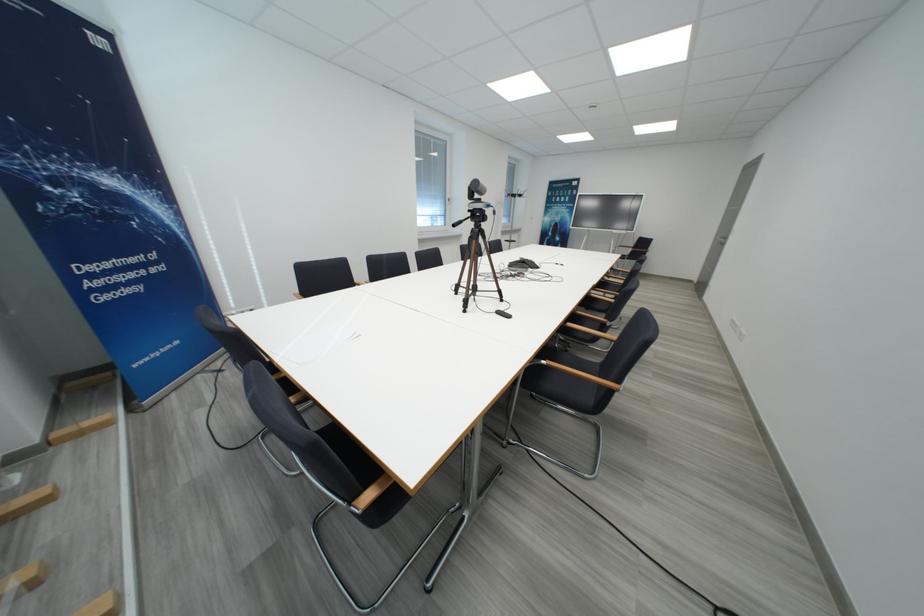
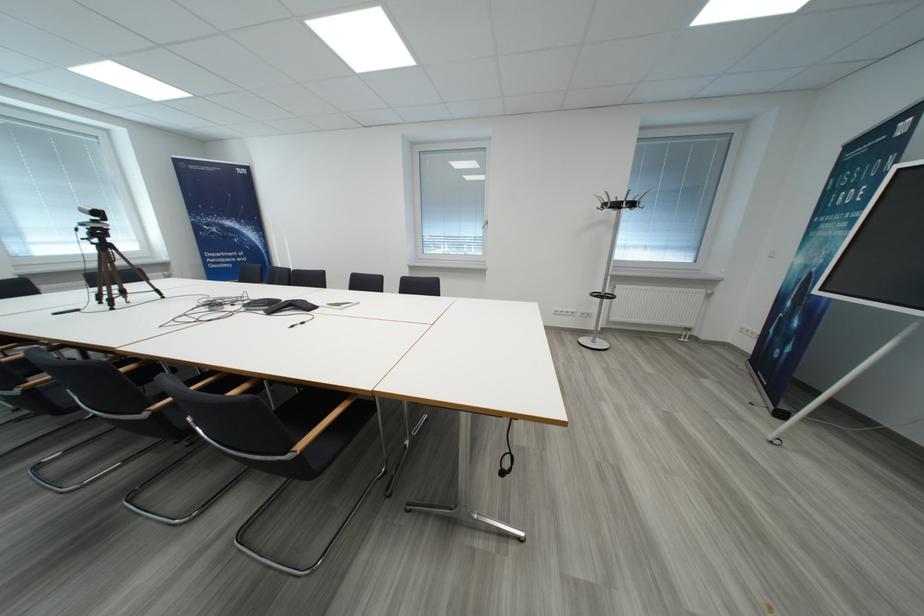
The point at (527,199) is marked in the first image. Where is the corresponding point in the second image?

(623, 208)